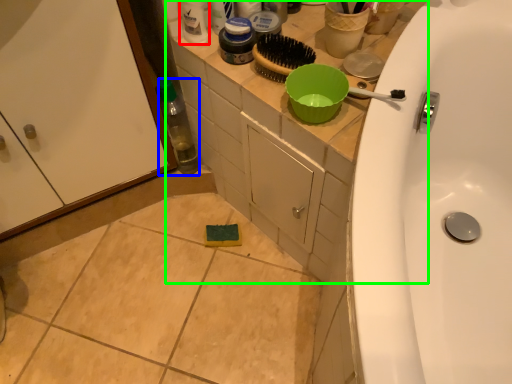
Question: Based on their relative distances, which object is nearer to cleaning product (highlighted by a red box)? Choose from bottle (highlighted by a blue box) and counter top (highlighted by a green box).

Choices:
 (A) bottle
 (B) counter top

Answer: (B)